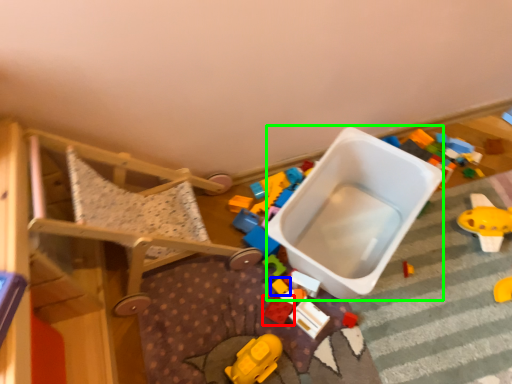
Question: Considering the real-world distances, which object is closest to toy (highlighted by a red box)? toy (highlighted by a blue box) or storage box (highlighted by a green box).

Choices:
 (A) toy
 (B) storage box

Answer: (A)